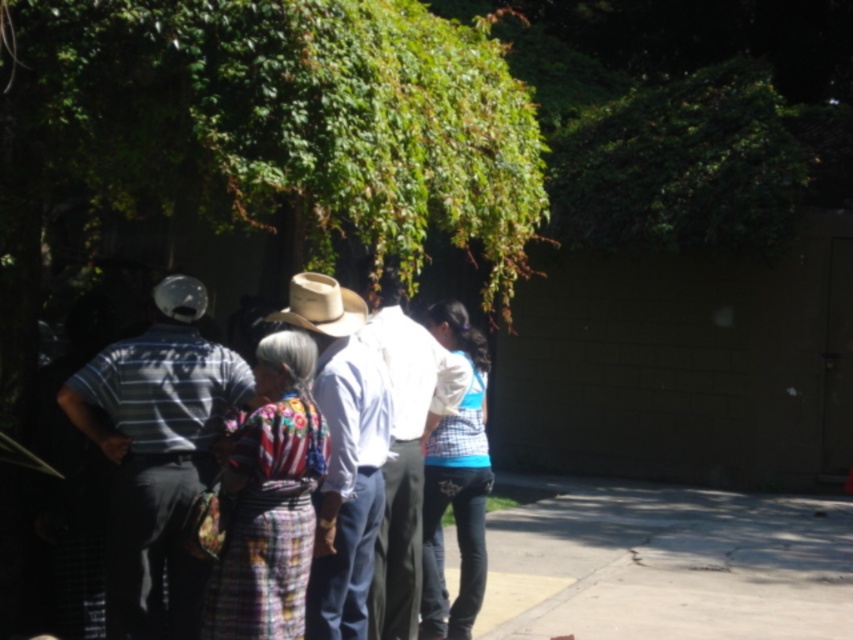
Question: Among these objects, which one is nearest to the camera?

Choices:
 (A) light brown straw cowboy hat at center
 (B) striped cotton shirt at left
 (C) white cotton shirt at center

Answer: (B)

Question: Among these points, which one is farthest from the camera?

Choices:
 (A) (355, 362)
 (B) (318, 314)
 (C) (381, 282)

Answer: (C)

Question: Which point is farther from the camera taking this photo?

Choices:
 (A) (363, 529)
 (B) (357, 317)

Answer: (B)

Question: Can you confirm if light brown woven hat at center is positioned to the right of light brown straw cowboy hat at center?

Choices:
 (A) yes
 (B) no

Answer: (A)

Question: Does white cotton shirt at center appear on the right side of light brown straw cowboy hat at center?

Choices:
 (A) yes
 (B) no

Answer: (A)

Question: Is light brown woven hat at center wider than light brown straw cowboy hat at center?

Choices:
 (A) no
 (B) yes

Answer: (B)